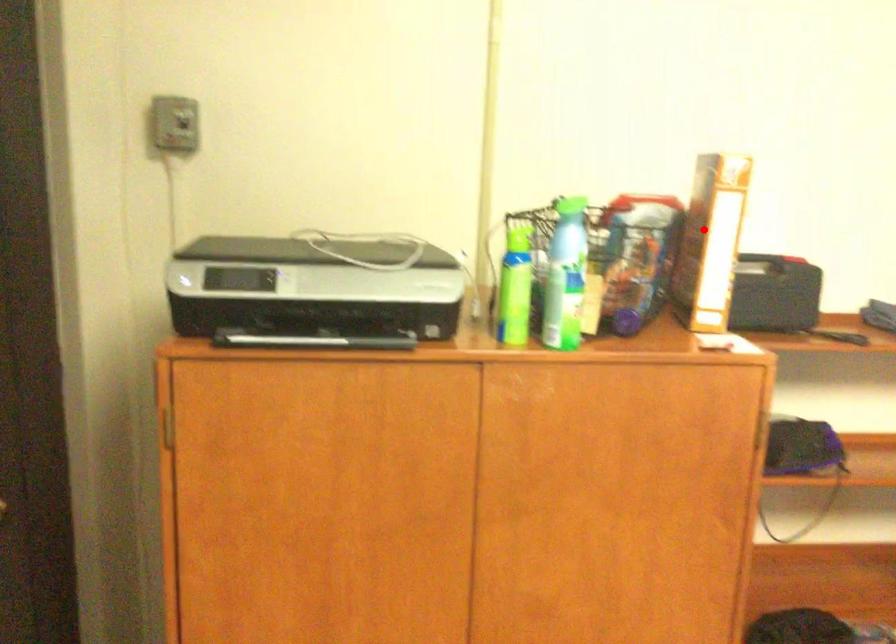
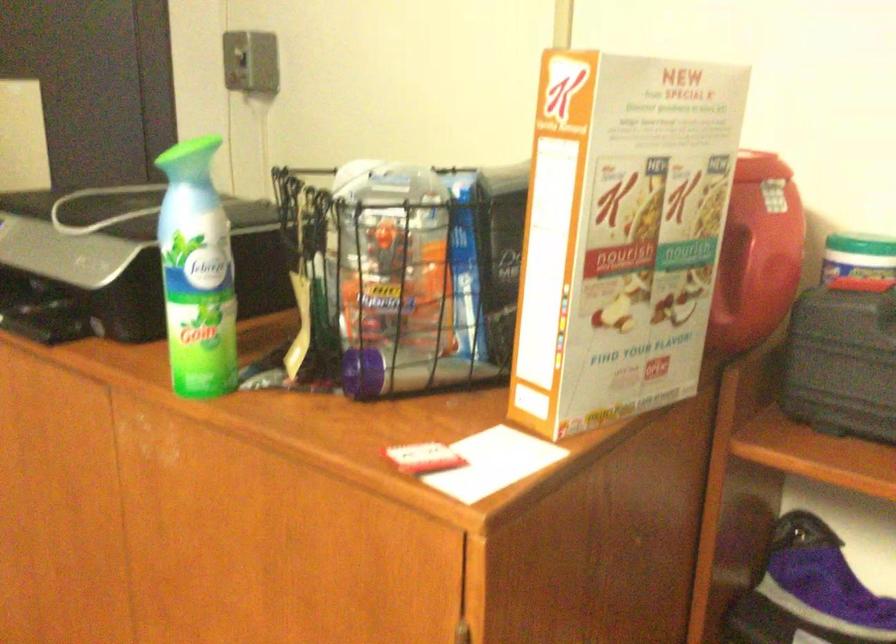
Where in the second image is the point corresponding to the highlighted location from the first image?

(756, 252)